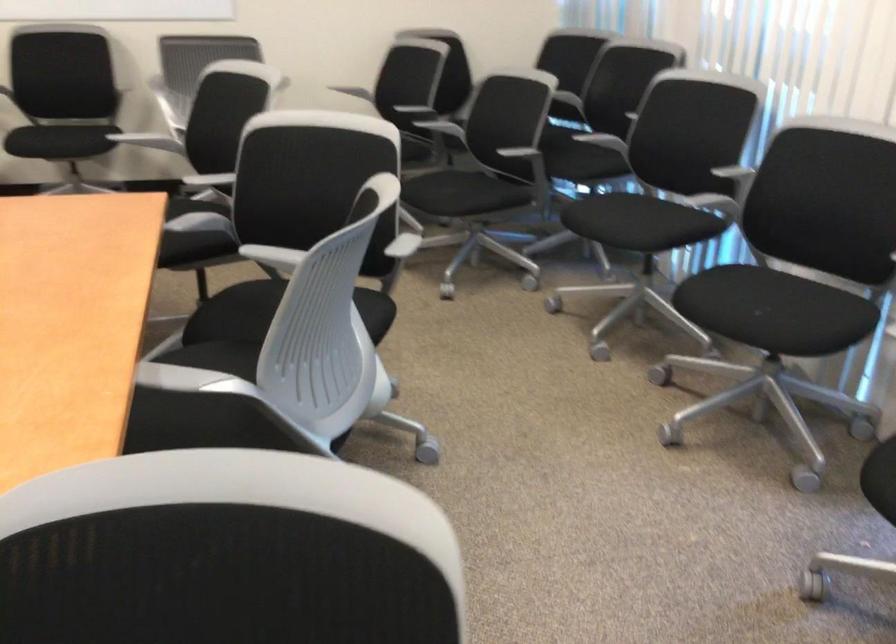
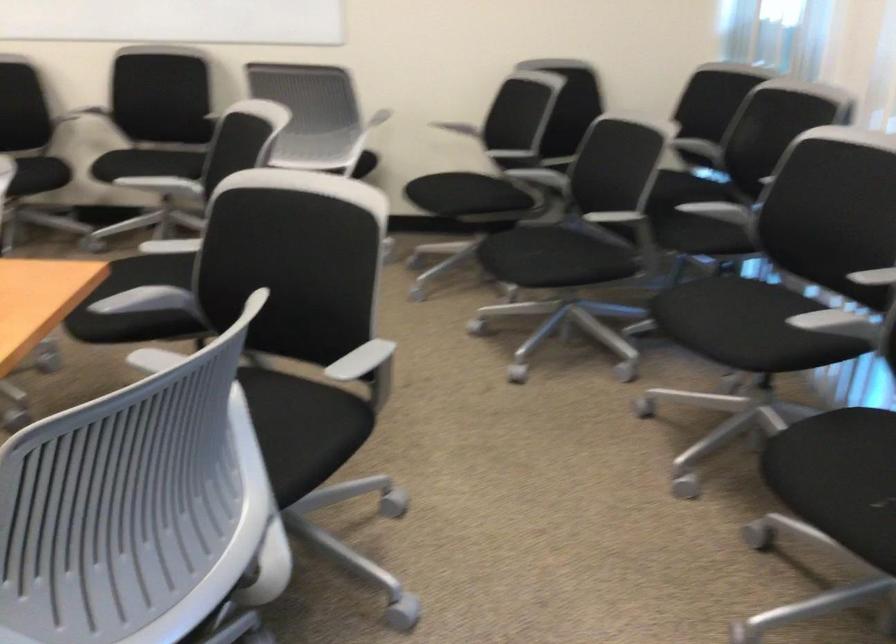
In the scene shown: Which direction would the cameraman need to move to produce the second image?

The movement direction of the cameraman is right, forward.